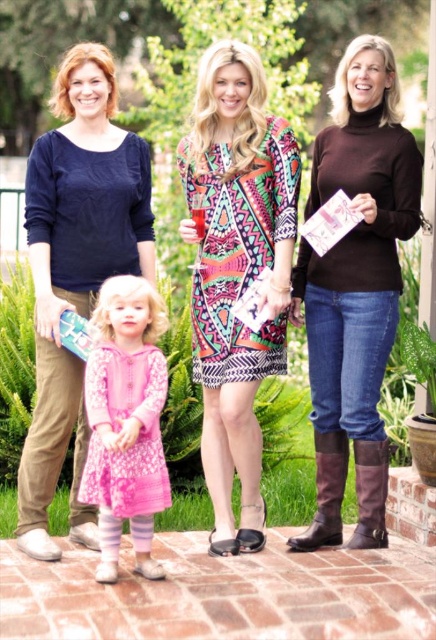
Is matte navy blue blouse at left positioned behind pink satin dress at lower left?

That is True.

Does matte navy blue blouse at left have a lesser height compared to pink satin dress at lower left?

Incorrect, matte navy blue blouse at left's height does not fall short of pink satin dress at lower left's.

The width and height of the screenshot is (436, 640). What do you see at coordinates (75, 269) in the screenshot?
I see `matte navy blue blouse at left` at bounding box center [75, 269].

Find the location of a particular element. The width and height of the screenshot is (436, 640). matte navy blue blouse at left is located at coordinates (75, 269).

Who is lower down, brown turtleneck sweater at center or printed fabric dress at center?

printed fabric dress at center

Who is positioned more to the left, brown turtleneck sweater at center or printed fabric dress at center?

printed fabric dress at center is more to the left.

Where is `brown turtleneck sweater at center`? brown turtleneck sweater at center is located at coordinates (356, 288).

This screenshot has width=436, height=640. Find the location of `brown turtleneck sweater at center`. brown turtleneck sweater at center is located at coordinates (356, 288).

Is pink satin dress at lower left smaller than brown leather boot at lower right?

No, pink satin dress at lower left is not smaller than brown leather boot at lower right.

The width and height of the screenshot is (436, 640). What do you see at coordinates (126, 420) in the screenshot? I see `pink satin dress at lower left` at bounding box center [126, 420].

What do you see at coordinates (126, 420) in the screenshot? The width and height of the screenshot is (436, 640). I see `pink satin dress at lower left` at bounding box center [126, 420].

I want to click on pink satin dress at lower left, so click(126, 420).